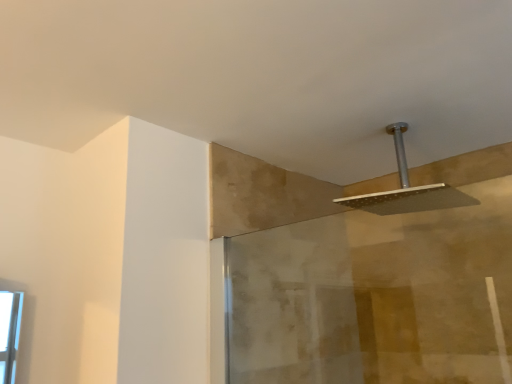
The height and width of the screenshot is (384, 512). I want to click on satin nickel showerhead at upper center, so click(407, 189).

Image resolution: width=512 pixels, height=384 pixels. What do you see at coordinates (407, 189) in the screenshot?
I see `satin nickel showerhead at upper center` at bounding box center [407, 189].

This screenshot has height=384, width=512. In order to click on satin nickel showerhead at upper center in this screenshot , I will do click(x=407, y=189).